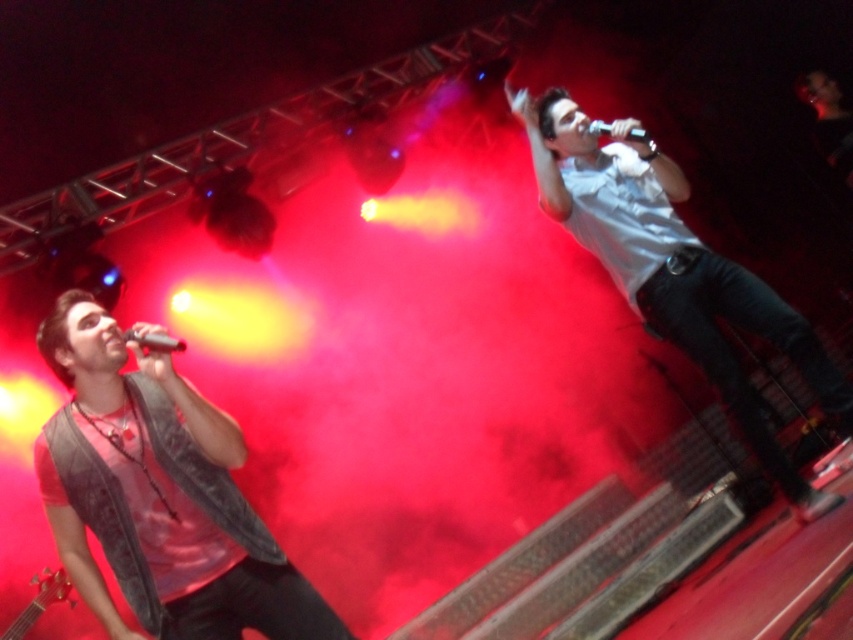
Can you confirm if denim vest at left is smaller than wooden acoustic guitar at lower left?

Indeed, denim vest at left has a smaller size compared to wooden acoustic guitar at lower left.

Does denim vest at left appear on the right side of wooden acoustic guitar at lower left?

Correct, you'll find denim vest at left to the right of wooden acoustic guitar at lower left.

Between point (80, 440) and point (48, 582), which one is positioned in front?

Point (80, 440) is in front.

You are a GUI agent. You are given a task and a screenshot of the screen. Output one action in this format:
    pyautogui.click(x=<x>, y=<y>)
    Task: Click on the denim vest at left
    
    Given the screenshot: What is the action you would take?
    pyautogui.click(x=160, y=497)

Is wooden acoustic guitar at lower left to the right of metallic silver microphone at upper left from the viewer's perspective?

No, wooden acoustic guitar at lower left is not to the right of metallic silver microphone at upper left.

Does point (33, 618) lie in front of point (172, 339)?

No, (33, 618) is behind (172, 339).

Describe the element at coordinates (39, 602) in the screenshot. Image resolution: width=853 pixels, height=640 pixels. I see `wooden acoustic guitar at lower left` at that location.

This screenshot has height=640, width=853. In order to click on wooden acoustic guitar at lower left in this screenshot , I will do `click(39, 602)`.

Is white matte shirt at upper right bigger than wooden acoustic guitar at lower left?

Yes, white matte shirt at upper right is bigger than wooden acoustic guitar at lower left.

Between white matte shirt at upper right and wooden acoustic guitar at lower left, which one appears on the right side from the viewer's perspective?

white matte shirt at upper right

Locate an element on the screen. This screenshot has width=853, height=640. white matte shirt at upper right is located at coordinates (674, 269).